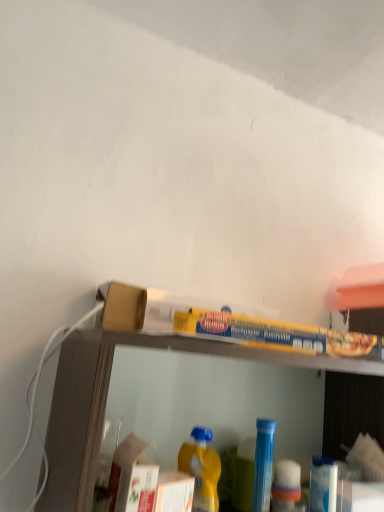
At what (x,y) coordinates should I click in order to perform the action: click on clear plastic shelf at upper center. Please return your answer as a coordinate pair (x, y). This screenshot has width=384, height=512. Looking at the image, I should click on (107, 398).

What are the coordinates of `blue plastic bottle at center, the 1th bottle positioned from the right` in the screenshot? It's located at [x=263, y=465].

Considering the sizes of clear plastic shelf at upper center and blue plastic bottle at center, acting as the second bottle starting from the left, in the image, is clear plastic shelf at upper center wider or thinner than blue plastic bottle at center, acting as the second bottle starting from the left,?

Clearly, clear plastic shelf at upper center has more width compared to blue plastic bottle at center, acting as the second bottle starting from the left.

Between clear plastic shelf at upper center and blue plastic bottle at center, the 1th bottle from the back, which one appears on the left side from the viewer's perspective?

clear plastic shelf at upper center is more to the left.

Is clear plastic shelf at upper center looking in the opposite direction of blue plastic bottle at center, the 1th bottle positioned from the right?

Yes, clear plastic shelf at upper center is facing away from blue plastic bottle at center, the 1th bottle positioned from the right.

From a real-world perspective, which is physically below, clear plastic shelf at upper center or blue plastic bottle at center, the 1th bottle from the back?

blue plastic bottle at center, the 1th bottle from the back, from a real-world perspective.

Considering the sizes of blue plastic bottle at center, acting as the second bottle starting from the left, and clear plastic shelf at upper center in the image, is blue plastic bottle at center, acting as the second bottle starting from the left, wider or thinner than clear plastic shelf at upper center?

Considering their sizes, blue plastic bottle at center, acting as the second bottle starting from the left, looks slimmer than clear plastic shelf at upper center.

Is blue plastic bottle at center, acting as the second bottle starting from the left, further to the viewer compared to clear plastic shelf at upper center?

Yes, blue plastic bottle at center, acting as the second bottle starting from the left, is behind clear plastic shelf at upper center.

Could you tell me if blue plastic bottle at center, the 1th bottle from the back, is turned towards clear plastic shelf at upper center?

Yes.

Can you tell me how much blue plastic bottle at center, marked as the second bottle in a front-to-back arrangement, and clear plastic shelf at upper center differ in facing direction?

0.00136 degrees separate the facing orientations of blue plastic bottle at center, marked as the second bottle in a front-to-back arrangement, and clear plastic shelf at upper center.

Considering the positions of points (269, 447) and (203, 507), is point (269, 447) closer to camera compared to point (203, 507)?

No, (269, 447) is further to viewer.

From the image's perspective, is blue plastic bottle at center, the 1th bottle from the back, positioned above or below yellow matte plastic bottle at lower center, marked as the 1th bottle in a left-to-right arrangement?

Based on their image positions, blue plastic bottle at center, the 1th bottle from the back, is located beneath yellow matte plastic bottle at lower center, marked as the 1th bottle in a left-to-right arrangement.

Is blue plastic bottle at center, the 1th bottle positioned from the right, wider than yellow matte plastic bottle at lower center, which is the 1th bottle in front-to-back order?

Indeed, blue plastic bottle at center, the 1th bottle positioned from the right, has a greater width compared to yellow matte plastic bottle at lower center, which is the 1th bottle in front-to-back order.

Between blue plastic bottle at center, acting as the second bottle starting from the left, and yellow matte plastic bottle at lower center, marked as the 1th bottle in a left-to-right arrangement, which one appears on the left side from the viewer's perspective?

yellow matte plastic bottle at lower center, marked as the 1th bottle in a left-to-right arrangement, is more to the left.

Is point (215, 502) positioned behind point (361, 364)?

That is False.

This screenshot has width=384, height=512. Find the location of `shelf that appears on the right of yellow matte plastic bottle at lower center, marked as the 1th bottle in a left-to-right arrangement`. shelf that appears on the right of yellow matte plastic bottle at lower center, marked as the 1th bottle in a left-to-right arrangement is located at coordinates (107, 398).

Can you confirm if yellow matte plastic bottle at lower center, marked as the 1th bottle in a left-to-right arrangement, is taller than clear plastic shelf at upper center?

Incorrect, the height of yellow matte plastic bottle at lower center, marked as the 1th bottle in a left-to-right arrangement, is not larger of that of clear plastic shelf at upper center.

Choose the correct answer: Is yellow matte plastic bottle at lower center, which is the 1th bottle in front-to-back order, inside clear plastic shelf at upper center or outside it?

yellow matte plastic bottle at lower center, which is the 1th bottle in front-to-back order, is inside clear plastic shelf at upper center.

Is blue plastic bottle at center, marked as the second bottle in a front-to-back arrangement, at the back of yellow matte plastic bottle at lower center, marked as the 1th bottle in a left-to-right arrangement?

No.

From the picture: From the image's perspective, which is below, yellow matte plastic bottle at lower center, which is the 1th bottle in front-to-back order, or blue plastic bottle at center, marked as the second bottle in a front-to-back arrangement?

blue plastic bottle at center, marked as the second bottle in a front-to-back arrangement, appears lower in the image.

From a real-world perspective, is yellow matte plastic bottle at lower center, the 2th bottle from the right, beneath blue plastic bottle at center, marked as the second bottle in a front-to-back arrangement?

Correct, in the physical world, yellow matte plastic bottle at lower center, the 2th bottle from the right, is lower than blue plastic bottle at center, marked as the second bottle in a front-to-back arrangement.

Considering the points (200, 432) and (262, 461), which point is behind, point (200, 432) or point (262, 461)?

The point (262, 461) is farther from the camera.

Which object is more forward, clear plastic shelf at upper center or yellow matte plastic bottle at lower center, marked as the 1th bottle in a left-to-right arrangement?

Positioned in front is clear plastic shelf at upper center.

Consider the image. From a real-world perspective, is clear plastic shelf at upper center positioned over yellow matte plastic bottle at lower center, the 2th bottle from the right, based on gravity?

Yes, from a real-world perspective, clear plastic shelf at upper center is on top of yellow matte plastic bottle at lower center, the 2th bottle from the right.

Is clear plastic shelf at upper center located outside yellow matte plastic bottle at lower center, which is the 1th bottle in front-to-back order?

clear plastic shelf at upper center lies outside yellow matte plastic bottle at lower center, which is the 1th bottle in front-to-back order,'s area.

This screenshot has width=384, height=512. In the image, there is a blue plastic bottle at center, the 1th bottle positioned from the right. In order to click on shelf above it (from the image's perspective) in this screenshot , I will do `click(107, 398)`.

Which bottle is the 2nd one when counting from the back of the clear plastic shelf at upper center? Please provide its 2D coordinates.

[(263, 465)]

Based on their spatial positions, is blue plastic bottle at center, the 1th bottle from the back, or yellow matte plastic bottle at lower center, which is the 1th bottle in front-to-back order, further from clear plastic shelf at upper center?

The object further to clear plastic shelf at upper center is blue plastic bottle at center, the 1th bottle from the back.

Estimate the real-world distances between objects in this image. Which object is closer to blue plastic bottle at center, acting as the second bottle starting from the left, clear plastic shelf at upper center or yellow matte plastic bottle at lower center, the 2th bottle from the right?

The object closer to blue plastic bottle at center, acting as the second bottle starting from the left, is yellow matte plastic bottle at lower center, the 2th bottle from the right.

Considering their positions, is clear plastic shelf at upper center positioned further to yellow matte plastic bottle at lower center, the 2th bottle from the right, than blue plastic bottle at center, the 1th bottle positioned from the right?

Based on the image, clear plastic shelf at upper center appears to be further to yellow matte plastic bottle at lower center, the 2th bottle from the right.

Estimate the real-world distances between objects in this image. Which object is further from blue plastic bottle at center, the 1th bottle positioned from the right, yellow matte plastic bottle at lower center, marked as the 1th bottle in a left-to-right arrangement, or clear plastic shelf at upper center?

clear plastic shelf at upper center is further to blue plastic bottle at center, the 1th bottle positioned from the right.

From the picture: Based on their spatial positions, is yellow matte plastic bottle at lower center, the 2th bottle from the right, or blue plastic bottle at center, the 1th bottle from the back, closer to clear plastic shelf at upper center?

yellow matte plastic bottle at lower center, the 2th bottle from the right, is closer to clear plastic shelf at upper center.

Which object lies nearer to the anchor point yellow matte plastic bottle at lower center, which is the 1th bottle in front-to-back order, blue plastic bottle at center, the 1th bottle positioned from the right, or clear plastic shelf at upper center?

Based on the image, blue plastic bottle at center, the 1th bottle positioned from the right, appears to be nearer to yellow matte plastic bottle at lower center, which is the 1th bottle in front-to-back order.

Identify the location of bottle positioned between clear plastic shelf at upper center and blue plastic bottle at center, the 1th bottle positioned from the right, from near to far. (201, 469).